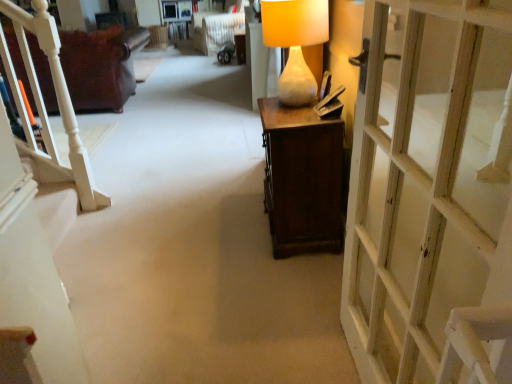
Question: Is white wooden door at right in front of leather couch at left?

Choices:
 (A) yes
 (B) no

Answer: (A)

Question: Considering the relative sizes of white wooden door at right and leather couch at left in the image provided, is white wooden door at right smaller than leather couch at left?

Choices:
 (A) no
 (B) yes

Answer: (B)

Question: Is white wooden door at right looking in the opposite direction of leather couch at left?

Choices:
 (A) no
 (B) yes

Answer: (A)

Question: Does white wooden door at right lie behind leather couch at left?

Choices:
 (A) yes
 (B) no

Answer: (B)

Question: Can you confirm if white wooden door at right is wider than leather couch at left?

Choices:
 (A) no
 (B) yes

Answer: (A)

Question: Is white textured armchair at upper center in front of or behind matte white vase at center in the image?

Choices:
 (A) front
 (B) behind

Answer: (B)

Question: From a real-world perspective, is white textured armchair at upper center positioned above or below matte white vase at center?

Choices:
 (A) above
 (B) below

Answer: (B)

Question: Considering the positions of white textured armchair at upper center and matte white vase at center in the image, is white textured armchair at upper center taller or shorter than matte white vase at center?

Choices:
 (A) short
 (B) tall

Answer: (B)

Question: Based on their sizes in the image, would you say white textured armchair at upper center is bigger or smaller than matte white vase at center?

Choices:
 (A) small
 (B) big

Answer: (B)

Question: Relative to white textured armchair at upper center, is matte white vase at center in front or behind?

Choices:
 (A) behind
 (B) front

Answer: (B)

Question: Visually, is matte white vase at center positioned to the left or to the right of white textured armchair at upper center?

Choices:
 (A) right
 (B) left

Answer: (A)

Question: From the image's perspective, is matte white vase at center above or below white textured armchair at upper center?

Choices:
 (A) above
 (B) below

Answer: (B)

Question: From a real-world perspective, is matte white vase at center positioned above or below white textured armchair at upper center?

Choices:
 (A) above
 (B) below

Answer: (A)

Question: Is matte white vase at center bigger or smaller than leather couch at left?

Choices:
 (A) small
 (B) big

Answer: (A)

Question: From the image's perspective, is matte white vase at center positioned above or below leather couch at left?

Choices:
 (A) above
 (B) below

Answer: (B)